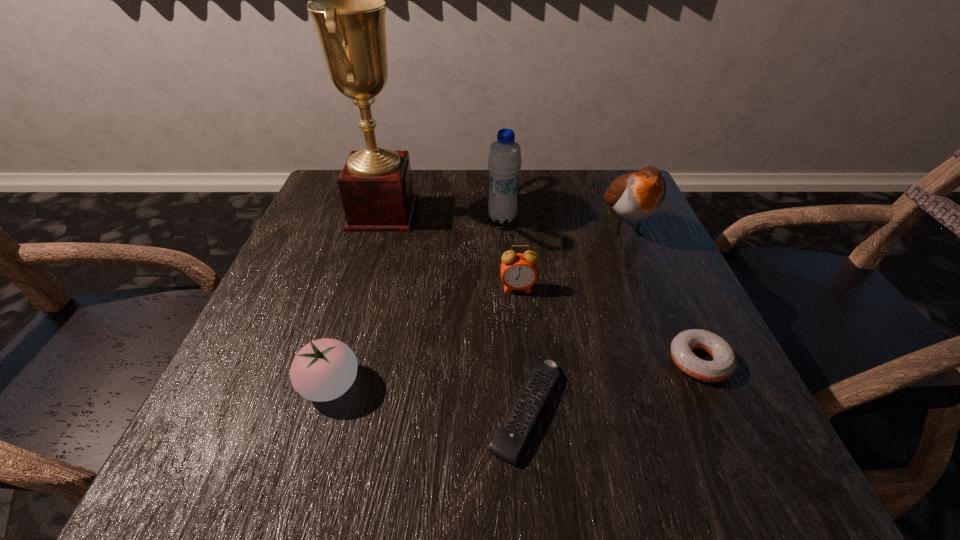
Find the location of a particular element. The height and width of the screenshot is (540, 960). free space that is in between the water bottle and the shortest object is located at coordinates (515, 314).

Find the location of a particular element. The width and height of the screenshot is (960, 540). vacant space in between the second shortest object and the trophy cup is located at coordinates (541, 287).

Image resolution: width=960 pixels, height=540 pixels. Identify the location of vacant area that lies between the water bottle and the tallest object. (443, 215).

Find the location of a particular element. empty location between the water bottle and the second shortest object is located at coordinates (601, 289).

In order to click on unoccupied area between the water bottle and the tallest object in this screenshot , I will do 443,215.

This screenshot has width=960, height=540. What are the coordinates of `free point between the fifth tallest object and the tallest object` in the screenshot? It's located at (356, 299).

The image size is (960, 540). What are the coordinates of `unoccupied position between the alarm clock and the remote control` in the screenshot? It's located at (522, 349).

The width and height of the screenshot is (960, 540). I want to click on unoccupied position between the sixth tallest object and the third shortest object, so click(x=515, y=373).

The height and width of the screenshot is (540, 960). In order to click on free space between the bird and the tomato in this screenshot , I will do `click(478, 306)`.

The image size is (960, 540). What are the coordinates of `vacant space that's between the doughnut and the third tallest object` in the screenshot? It's located at tap(662, 294).